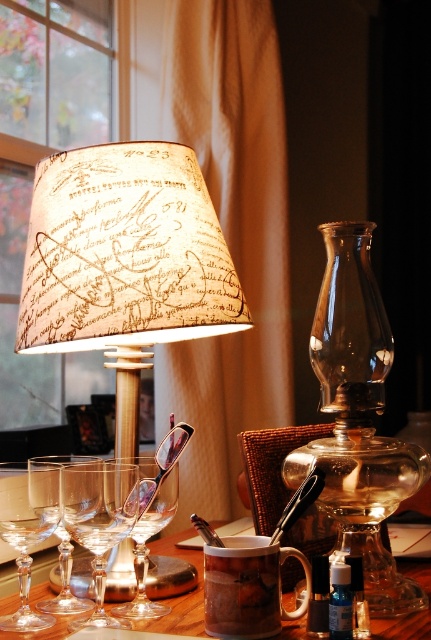
You are organizing items on a wooden table. You need to place a decorative item on the table that must be positioned below the beige paper lampshade at upper left. Can you place it where the clear glass wine glass at lower left is currently located?

Yes, the clear glass wine glass at lower left is located below the beige paper lampshade at upper left, so placing the decorative item there would satisfy the requirement.

You are a guest in this study and want to grab a drink. The brown matte mug at center contains tea, while the clear crystal wine glass at lower left has water. Which one is closer to you if you are standing at the table?

The clear crystal wine glass at lower left is closer to you since it is positioned above the brown matte mug at center, which is located below it.

You are organizing items on a table and need to place a new decorative item. The beige paper lampshade at upper left and the clear glass wine glass at lower left are already there. Which item has more space around it for placing something new?

The beige paper lampshade at upper left has more space around it because it is larger in size than the clear glass wine glass at lower left, meaning it occupies more area and likely has more surrounding space available.